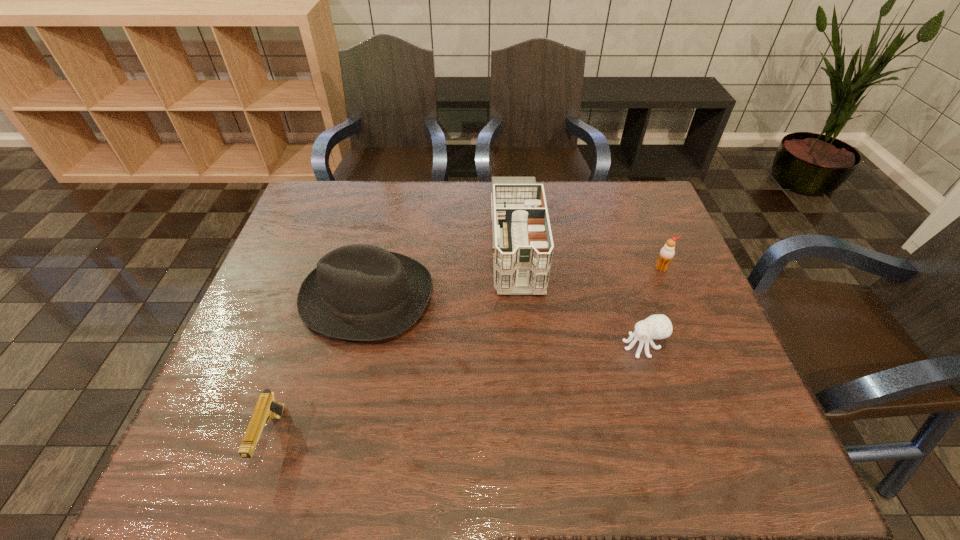
Identify the location of dollhouse. (523, 246).

The height and width of the screenshot is (540, 960). Identify the location of fedora. (359, 292).

At what (x,y) coordinates should I click in order to perform the action: click on the rightmost object. Please return your answer as a coordinate pair (x, y). Image resolution: width=960 pixels, height=540 pixels. Looking at the image, I should click on 667,252.

The width and height of the screenshot is (960, 540). I want to click on the fourth object from left to right, so click(659, 326).

Find the location of a particular element. The height and width of the screenshot is (540, 960). the shortest object is located at coordinates (267, 408).

At what (x,y) coordinates should I click in order to perform the action: click on the nearest object. Please return your answer as a coordinate pair (x, y). Image resolution: width=960 pixels, height=540 pixels. Looking at the image, I should click on (267, 408).

Find the location of `vacant space located at the entrance of the third object from left to right`. vacant space located at the entrance of the third object from left to right is located at coordinates (530, 417).

Where is `vacant region located on the front of the fedora`? The height and width of the screenshot is (540, 960). vacant region located on the front of the fedora is located at coordinates (350, 369).

Find the location of a particular element. This screenshot has height=540, width=960. vacant area located at the front with a straw on the rightmost object is located at coordinates (716, 403).

Image resolution: width=960 pixels, height=540 pixels. In order to click on free space located on the front-facing side of the octopus in this screenshot , I will do `click(547, 346)`.